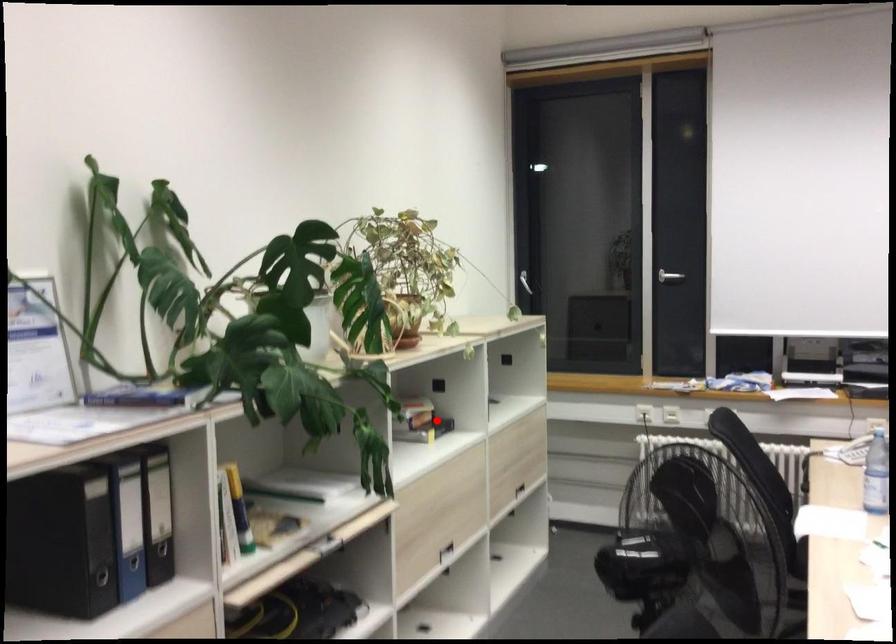
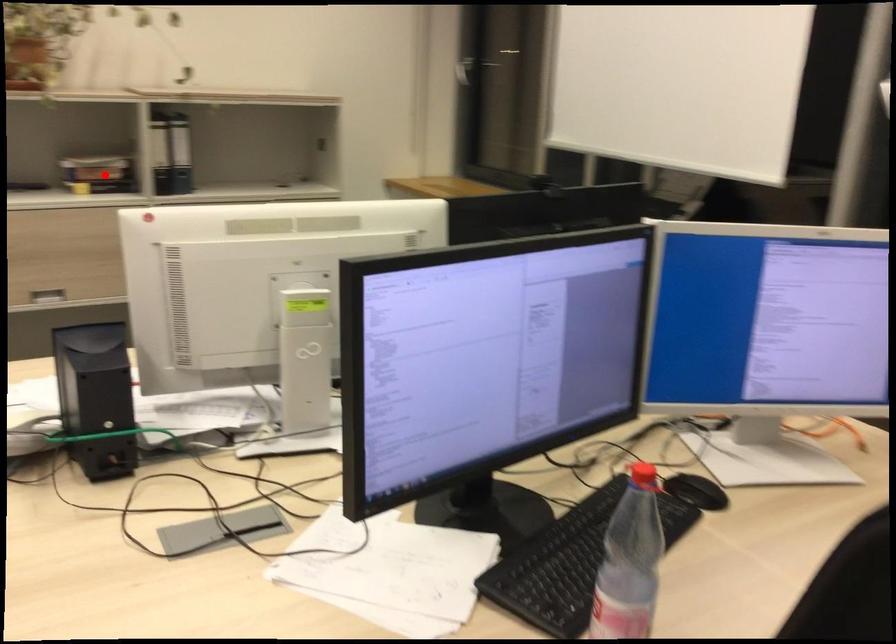
I am providing you with two images of the same scene from different viewpoints. A red point is marked on the first image and another point is marked on the second image. Does the point marked in image1 correspond to the same location as the one in image2?

Yes